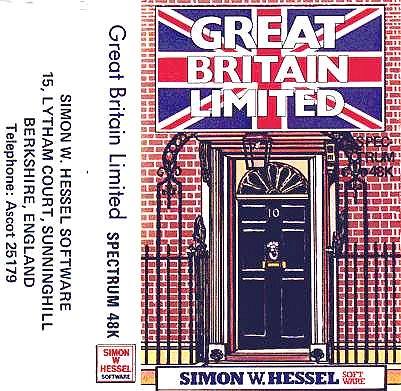
At what (x,y) coordinates should I click in order to perform the action: click on door window. Please return your answer as a coordinate pair (x, y). The width and height of the screenshot is (401, 391). Looking at the image, I should click on (275, 183).